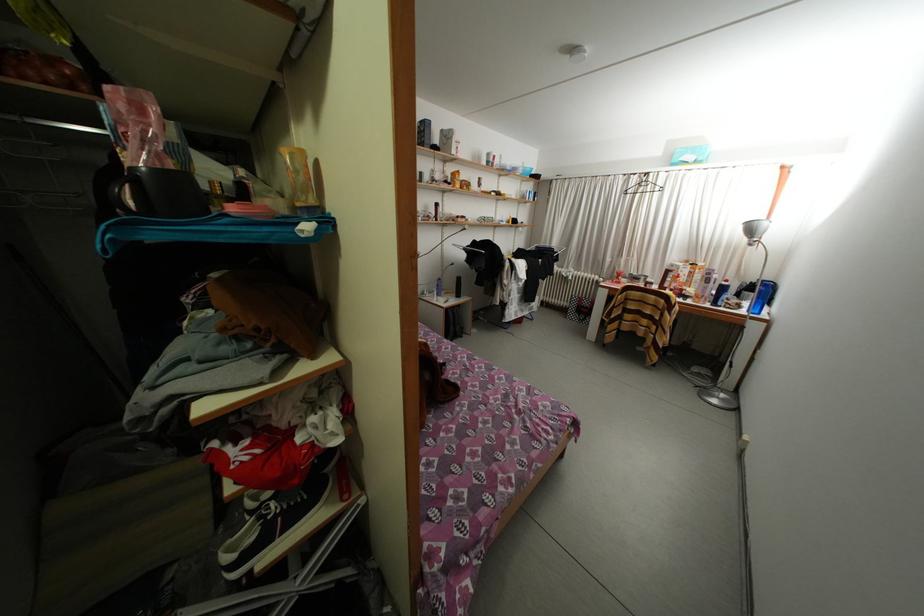
Locate an element on the screen. Image resolution: width=924 pixels, height=616 pixels. silver lamp head is located at coordinates (773, 237).